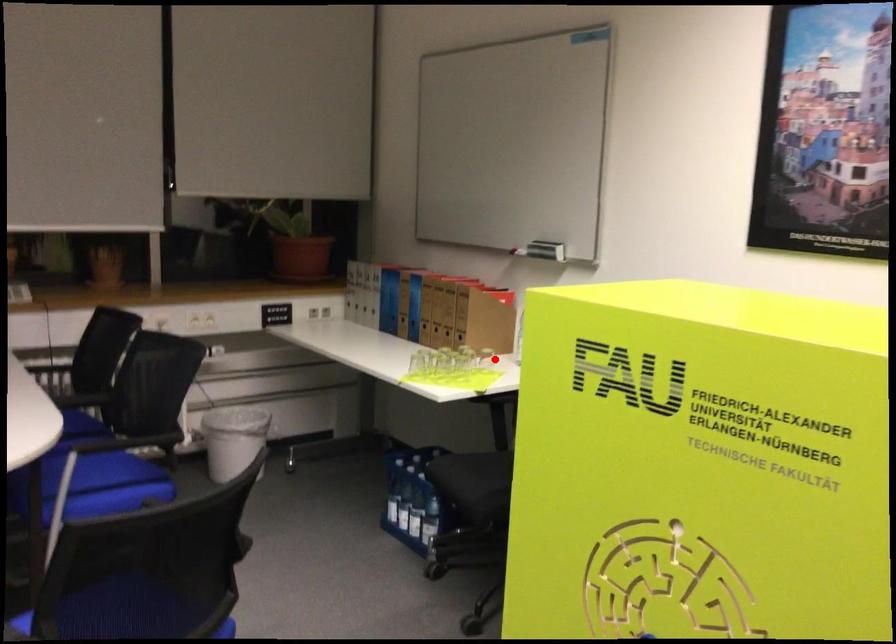
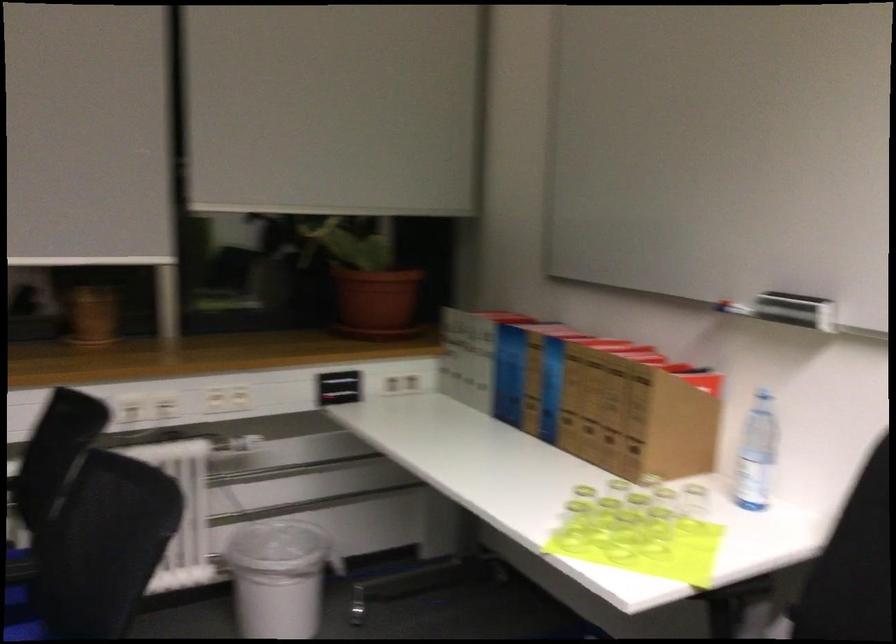
Question: I am providing you with two images of the same scene from different viewpoints. Given a red point in image1, look at the same physical point in image2. Is it:

Choices:
 (A) Closer to the viewpoint
 (B) Farther from the viewpoint

Answer: (A)